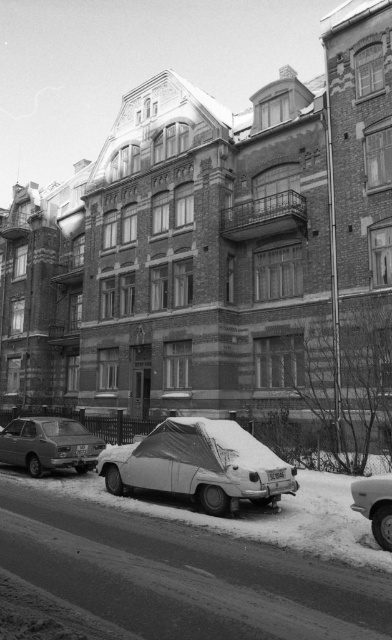
Does snow-covered car at center have a greater height compared to matte silver sedan at lower left?

Incorrect, snow-covered car at center's height is not larger of matte silver sedan at lower left's.

Identify the location of snow-covered car at center. (199, 465).

Can you confirm if matte silver sedan at lower left is smaller than snow-covered car at lower right?

Incorrect, matte silver sedan at lower left is not smaller in size than snow-covered car at lower right.

What do you see at coordinates (49, 444) in the screenshot? I see `matte silver sedan at lower left` at bounding box center [49, 444].

Is point (58, 440) more distant than point (388, 538)?

Yes, point (58, 440) is behind point (388, 538).

What are the coordinates of `matte silver sedan at lower left` in the screenshot? It's located at (49, 444).

Is snow-covered car at center closer to camera compared to snow-covered car at lower right?

No.

Can you confirm if snow-covered car at center is bigger than snow-covered car at lower right?

No.

The height and width of the screenshot is (640, 392). I want to click on snow-covered car at center, so click(x=199, y=465).